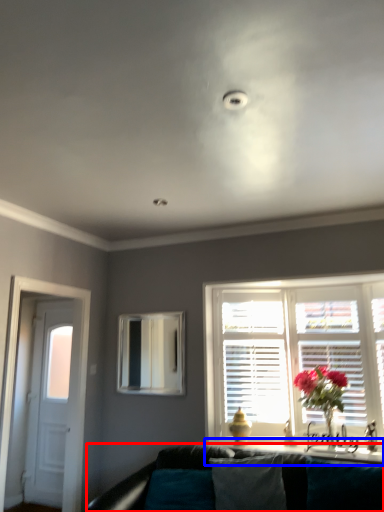
Question: Which point is closer to the camera, studio couch (highlighted by a red box) or window sill (highlighted by a blue box)?

Choices:
 (A) studio couch
 (B) window sill

Answer: (A)